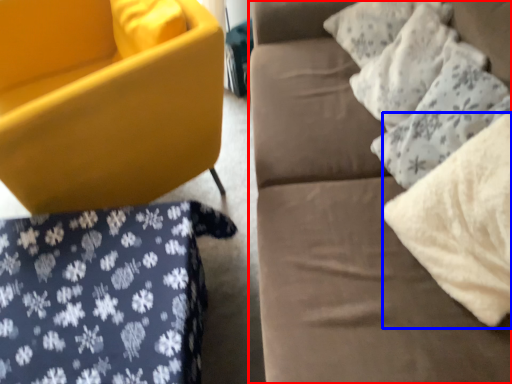
Question: Which point is closer to the camera, studio couch (highlighted by a red box) or material (highlighted by a blue box)?

Choices:
 (A) studio couch
 (B) material

Answer: (A)